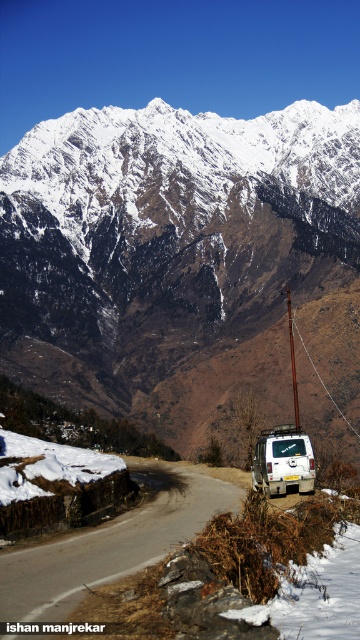
Does white matte van at lower right have a smaller size compared to brown wooden pole at center?

Yes.

Does white matte van at lower right come in front of brown wooden pole at center?

Yes, it is.

Does point (268, 449) come closer to viewer compared to point (299, 422)?

Yes.

Where is `white matte van at lower right`? The image size is (360, 640). white matte van at lower right is located at coordinates (282, 460).

Is snowy granite mountain range at upper center positioned before brown wooden pole at center?

No.

Who is more forward, (321, 141) or (290, 314)?

Point (290, 314) is more forward.

What are the coordinates of `snowy granite mountain range at upper center` in the screenshot? It's located at (182, 262).

Is the position of snowy granite mountain range at upper center less distant than that of white matte van at lower right?

No, snowy granite mountain range at upper center is further to the viewer.

Measure the distance between snowy granite mountain range at upper center and camera.

snowy granite mountain range at upper center and camera are 395.85 meters apart.

I want to click on snowy granite mountain range at upper center, so click(182, 262).